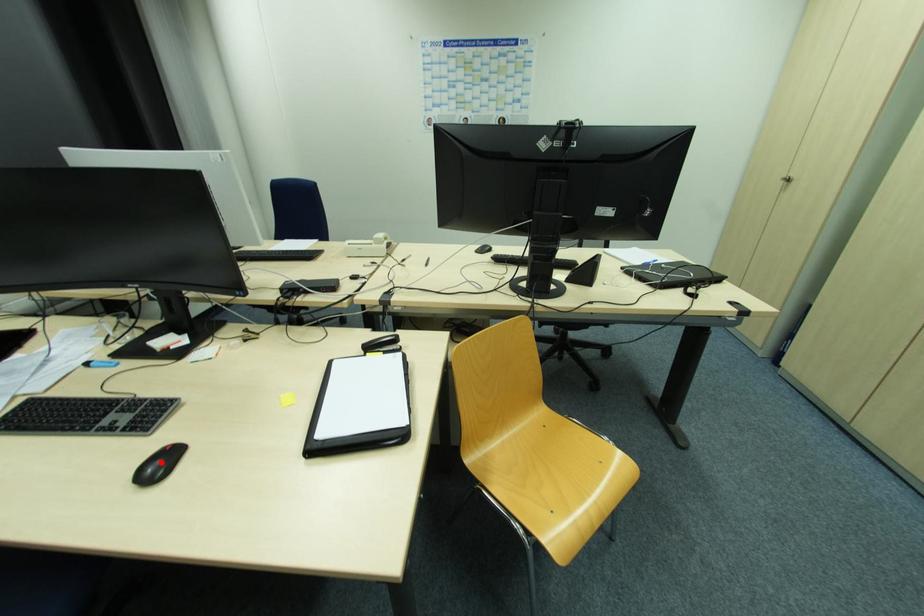
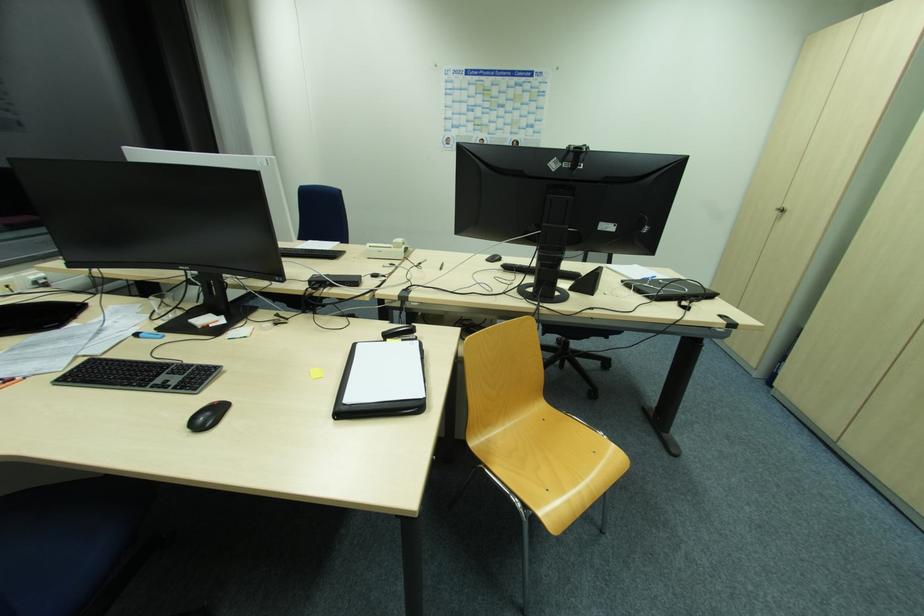
Find the pixel in the second image that matches the highlighted location in the first image.

(211, 415)